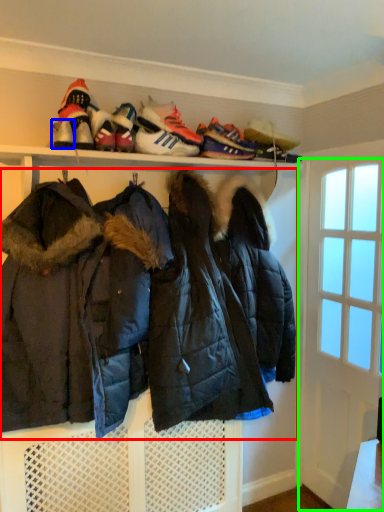
Question: Which object is the closest to the jacket (highlighted by a red box)? Choose among these: shoe (highlighted by a blue box) or door (highlighted by a green box).

Choices:
 (A) shoe
 (B) door

Answer: (B)